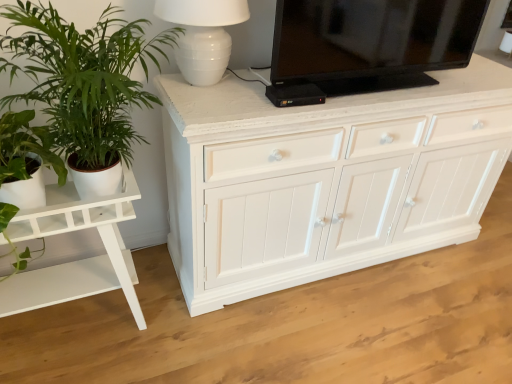
Question: Is green leafy plant at left not inside white ceramic lamp at upper center?

Choices:
 (A) no
 (B) yes

Answer: (B)

Question: Is green leafy plant at left turned away from white ceramic lamp at upper center?

Choices:
 (A) yes
 (B) no

Answer: (B)

Question: Is green leafy plant at left bigger than white ceramic lamp at upper center?

Choices:
 (A) no
 (B) yes

Answer: (B)

Question: Would you say green leafy plant at left is a long distance from white ceramic lamp at upper center?

Choices:
 (A) yes
 (B) no

Answer: (B)

Question: Is green leafy plant at left smaller than white ceramic lamp at upper center?

Choices:
 (A) yes
 (B) no

Answer: (B)

Question: Considering their positions, is white ceramic lamp at upper center located in front of or behind black glossy television at upper center?

Choices:
 (A) front
 (B) behind

Answer: (A)

Question: From a real-world perspective, is white ceramic lamp at upper center physically located above or below black glossy television at upper center?

Choices:
 (A) below
 (B) above

Answer: (A)

Question: From their relative heights in the image, would you say white ceramic lamp at upper center is taller or shorter than black glossy television at upper center?

Choices:
 (A) short
 (B) tall

Answer: (A)

Question: Considering the relative positions of white ceramic lamp at upper center and black glossy television at upper center in the image provided, is white ceramic lamp at upper center to the left or to the right of black glossy television at upper center?

Choices:
 (A) left
 (B) right

Answer: (A)

Question: Do you think white glossy table at left is within black glossy television at upper center, or outside of it?

Choices:
 (A) outside
 (B) inside

Answer: (A)

Question: From a real-world perspective, relative to black glossy television at upper center, is white glossy table at left vertically above or below?

Choices:
 (A) below
 (B) above

Answer: (A)

Question: Considering the positions of white glossy table at left and black glossy television at upper center in the image, is white glossy table at left wider or thinner than black glossy television at upper center?

Choices:
 (A) thin
 (B) wide

Answer: (B)

Question: Is white glossy table at left bigger or smaller than black glossy television at upper center?

Choices:
 (A) big
 (B) small

Answer: (A)

Question: Is black glossy television at upper center in front of or behind green leafy plant at left in the image?

Choices:
 (A) behind
 (B) front

Answer: (A)

Question: Is point (410, 76) closer or farther from the camera than point (67, 157)?

Choices:
 (A) closer
 (B) farther

Answer: (B)